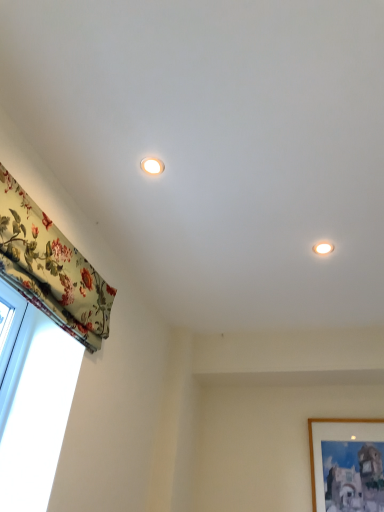
This screenshot has height=512, width=384. Describe the element at coordinates (152, 166) in the screenshot. I see `matte white light fixture at upper center, which is counted as the 2th lighting, starting from the bottom` at that location.

Measure the distance between point (338,490) and camera.

Point (338,490) and camera are 7.11 feet apart.

Describe the element at coordinates (51, 268) in the screenshot. This screenshot has width=384, height=512. I see `floral fabric curtain at left` at that location.

Locate an element on the screen. The width and height of the screenshot is (384, 512). matte white light fixture at upper right, the second lighting positioned from the left is located at coordinates (323, 248).

From the image's perspective, between matte white light fixture at upper right, the second lighting positioned from the left, and floral fabric curtain at left, which one is located above?

matte white light fixture at upper right, the second lighting positioned from the left, is shown above in the image.

Between matte white light fixture at upper right, arranged as the 2th lighting when viewed from the top, and floral fabric curtain at left, which one is positioned behind?

matte white light fixture at upper right, arranged as the 2th lighting when viewed from the top, is more distant.

Which object is wider, matte white light fixture at upper right, placed as the 1th lighting when sorted from back to front, or floral fabric curtain at left?

With larger width is matte white light fixture at upper right, placed as the 1th lighting when sorted from back to front.

Which point is more distant from viewer, (318, 245) or (71, 269)?

Point (318, 245)

Considering the positions of objects matte white light fixture at upper center, the first lighting when ordered from left to right, and matte white light fixture at upper right, the 1th lighting in the right-to-left sequence, in the image provided, who is behind, matte white light fixture at upper center, the first lighting when ordered from left to right, or matte white light fixture at upper right, the 1th lighting in the right-to-left sequence,?

matte white light fixture at upper right, the 1th lighting in the right-to-left sequence, is further from the camera.

Does matte white light fixture at upper center, the second lighting positioned from the right, have a smaller size compared to matte white light fixture at upper right, arranged as the 2th lighting when viewed from the top?

Indeed, matte white light fixture at upper center, the second lighting positioned from the right, has a smaller size compared to matte white light fixture at upper right, arranged as the 2th lighting when viewed from the top.

Can you confirm if matte white light fixture at upper center, the second lighting positioned from the right, is positioned to the left of matte white light fixture at upper right, the second lighting positioned from the left?

Indeed, matte white light fixture at upper center, the second lighting positioned from the right, is positioned on the left side of matte white light fixture at upper right, the second lighting positioned from the left.

Is point (146, 164) closer to viewer compared to point (314, 248)?

Yes, it is.

Is floral fabric curtain at left inside or outside of matte white light fixture at upper right, which ranks as the 2th lighting in front-to-back order?

floral fabric curtain at left is located beyond the bounds of matte white light fixture at upper right, which ranks as the 2th lighting in front-to-back order.

Are floral fabric curtain at left and matte white light fixture at upper right, the second lighting positioned from the left, beside each other?

No.

From a real-world perspective, who is located lower, floral fabric curtain at left or matte white light fixture at upper right, which ranks as the 1th lighting in bottom-to-top order?

In real-world perspective, floral fabric curtain at left is lower.

How different are the orientations of floral fabric curtain at left and matte white light fixture at upper right, arranged as the 2th lighting when viewed from the top, in degrees?

93.4 degrees separate the facing orientations of floral fabric curtain at left and matte white light fixture at upper right, arranged as the 2th lighting when viewed from the top.

Considering the sizes of objects floral fabric curtain at left and wooden picture frame at lower right in the image provided, who is bigger, floral fabric curtain at left or wooden picture frame at lower right?

Bigger between the two is floral fabric curtain at left.

Is floral fabric curtain at left with wooden picture frame at lower right?

No, floral fabric curtain at left is not next to wooden picture frame at lower right.

Considering the positions of objects floral fabric curtain at left and wooden picture frame at lower right in the image provided, who is more to the left, floral fabric curtain at left or wooden picture frame at lower right?

Positioned to the left is floral fabric curtain at left.

From a real-world perspective, is floral fabric curtain at left physically located above or below wooden picture frame at lower right?

Clearly, from a real-world perspective, floral fabric curtain at left is above wooden picture frame at lower right.

Is matte white light fixture at upper right, arranged as the 2th lighting when viewed from the top, bigger or smaller than matte white light fixture at upper center, the first lighting when ordered from left to right?

matte white light fixture at upper right, arranged as the 2th lighting when viewed from the top, is bigger than matte white light fixture at upper center, the first lighting when ordered from left to right.

Who is more distant, matte white light fixture at upper right, the second lighting positioned from the left, or matte white light fixture at upper center, the 1th lighting viewed from the front?

Positioned behind is matte white light fixture at upper right, the second lighting positioned from the left.

Is matte white light fixture at upper right, placed as the 1th lighting when sorted from back to front, facing away from matte white light fixture at upper center, the 1th lighting viewed from the top?

No.

How far apart are matte white light fixture at upper right, placed as the 1th lighting when sorted from back to front, and matte white light fixture at upper center, the 1th lighting viewed from the top?

They are 29.33 inches apart.

Could wooden picture frame at lower right be considered to be inside matte white light fixture at upper center, which is counted as the 2th lighting, starting from the bottom?

Definitely not — wooden picture frame at lower right is not inside matte white light fixture at upper center, which is counted as the 2th lighting, starting from the bottom.

Between matte white light fixture at upper center, the 1th lighting viewed from the front, and wooden picture frame at lower right, which one has smaller width?

wooden picture frame at lower right is thinner.

Is matte white light fixture at upper center, the second lighting positioned from the right, turned away from wooden picture frame at lower right?

No, matte white light fixture at upper center, the second lighting positioned from the right, is not facing the opposite direction of wooden picture frame at lower right.

Between matte white light fixture at upper center, the 1th lighting viewed from the top, and wooden picture frame at lower right, which one is positioned behind?

wooden picture frame at lower right is further from the camera.

Where is `picture frame behind the matte white light fixture at upper right, the second lighting positioned from the left`? The width and height of the screenshot is (384, 512). picture frame behind the matte white light fixture at upper right, the second lighting positioned from the left is located at coordinates (347, 465).

Does point (327, 253) come behind point (315, 463)?

No, it is in front of (315, 463).

From the image's perspective, is matte white light fixture at upper right, which ranks as the 2th lighting in front-to-back order, below wooden picture frame at lower right?

No, from the image's perspective, matte white light fixture at upper right, which ranks as the 2th lighting in front-to-back order, is not beneath wooden picture frame at lower right.

At what (x,y) coordinates should I click in order to perform the action: click on the 2nd lighting behind the floral fabric curtain at left. Please return your answer as a coordinate pair (x, y). Image resolution: width=384 pixels, height=512 pixels. Looking at the image, I should click on (323, 248).

Locate an element on the screen. This screenshot has height=512, width=384. lighting below the matte white light fixture at upper center, which is counted as the 2th lighting, starting from the bottom (from the image's perspective) is located at coordinates 323,248.

Considering their positions, is matte white light fixture at upper center, the 1th lighting viewed from the front, positioned closer to matte white light fixture at upper right, the second lighting positioned from the left, than wooden picture frame at lower right?

matte white light fixture at upper center, the 1th lighting viewed from the front, is positioned closer to the anchor matte white light fixture at upper right, the second lighting positioned from the left.

When comparing their distances from floral fabric curtain at left, does wooden picture frame at lower right or matte white light fixture at upper center, the second lighting positioned from the right, seem further?

wooden picture frame at lower right is positioned further to the anchor floral fabric curtain at left.

When comparing their distances from wooden picture frame at lower right, does matte white light fixture at upper center, the first lighting when ordered from left to right, or floral fabric curtain at left seem further?

matte white light fixture at upper center, the first lighting when ordered from left to right, lies further to wooden picture frame at lower right than the other object.

Which object lies nearer to the anchor point matte white light fixture at upper right, arranged as the 2th lighting when viewed from the top, matte white light fixture at upper center, marked as the 2th lighting in a back-to-front arrangement, or floral fabric curtain at left?

matte white light fixture at upper center, marked as the 2th lighting in a back-to-front arrangement.

Looking at the image, which one is located closer to wooden picture frame at lower right, matte white light fixture at upper center, the 1th lighting viewed from the front, or matte white light fixture at upper right, the 1th lighting in the right-to-left sequence?

Based on the image, matte white light fixture at upper right, the 1th lighting in the right-to-left sequence, appears to be nearer to wooden picture frame at lower right.

From the picture: Based on their spatial positions, is matte white light fixture at upper right, placed as the 1th lighting when sorted from back to front, or wooden picture frame at lower right closer to floral fabric curtain at left?

matte white light fixture at upper right, placed as the 1th lighting when sorted from back to front, is closer to floral fabric curtain at left.

From the image, which object appears to be nearer to matte white light fixture at upper right, the 1th lighting in the right-to-left sequence, floral fabric curtain at left or matte white light fixture at upper center, the first lighting when ordered from left to right?

matte white light fixture at upper center, the first lighting when ordered from left to right.

Based on their spatial positions, is matte white light fixture at upper center, the second lighting positioned from the right, or matte white light fixture at upper right, the second lighting positioned from the left, further from floral fabric curtain at left?

Based on the image, matte white light fixture at upper right, the second lighting positioned from the left, appears to be further to floral fabric curtain at left.

You are a GUI agent. You are given a task and a screenshot of the screen. Output one action in this format:
    pyautogui.click(x=<x>, y=<y>)
    Task: Click on the lighting between matte white light fixture at upper center, the 1th lighting viewed from the top, and wooden picture frame at lower right vertically
    
    Given the screenshot: What is the action you would take?
    pyautogui.click(x=323, y=248)

In order to click on curtain between matte white light fixture at upper center, the 1th lighting viewed from the front, and wooden picture frame at lower right, in the vertical direction in this screenshot , I will do `click(51, 268)`.

The image size is (384, 512). Find the location of `lighting located between floral fabric curtain at left and matte white light fixture at upper right, arranged as the 2th lighting when viewed from the top, in the left-right direction`. lighting located between floral fabric curtain at left and matte white light fixture at upper right, arranged as the 2th lighting when viewed from the top, in the left-right direction is located at coordinates (152, 166).